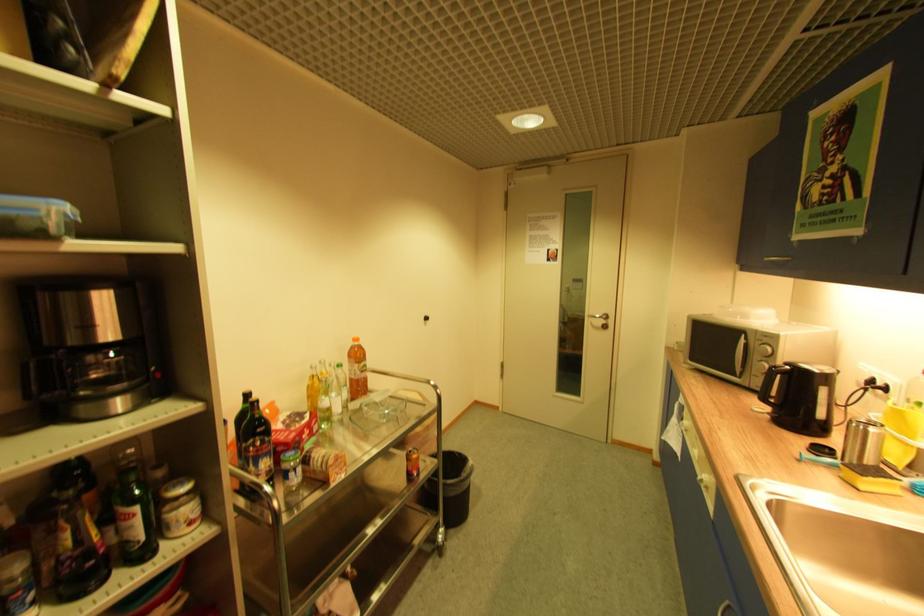
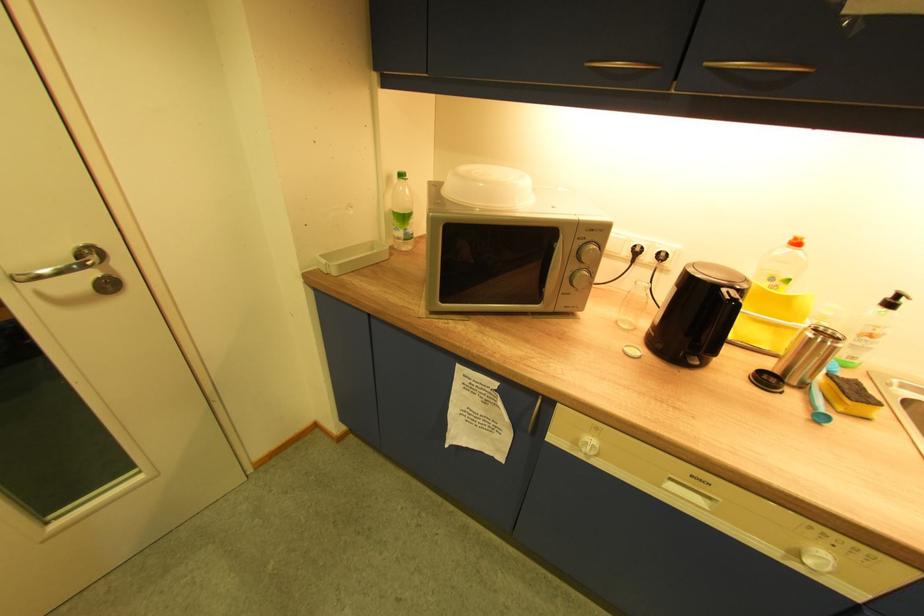
Find the pixel in the second image that matches pixel 865 427 in the first image.

(830, 342)